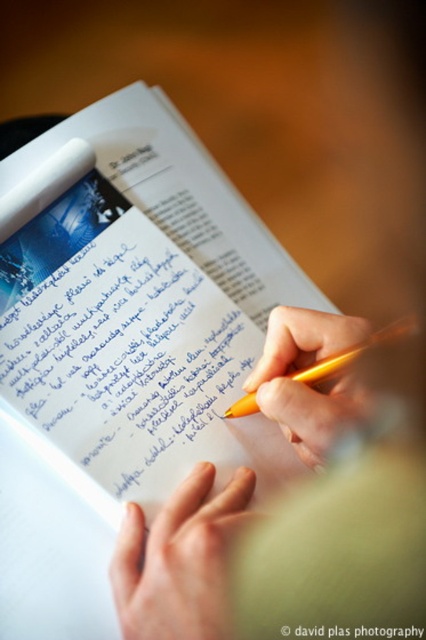
Is smooth skin hand at center thinner than yellow plastic pen at center?

No.

Does smooth skin hand at center have a lesser height compared to yellow plastic pen at center?

Indeed, smooth skin hand at center has a lesser height compared to yellow plastic pen at center.

Image resolution: width=426 pixels, height=640 pixels. What are the coordinates of `smooth skin hand at center` in the screenshot? It's located at (180, 561).